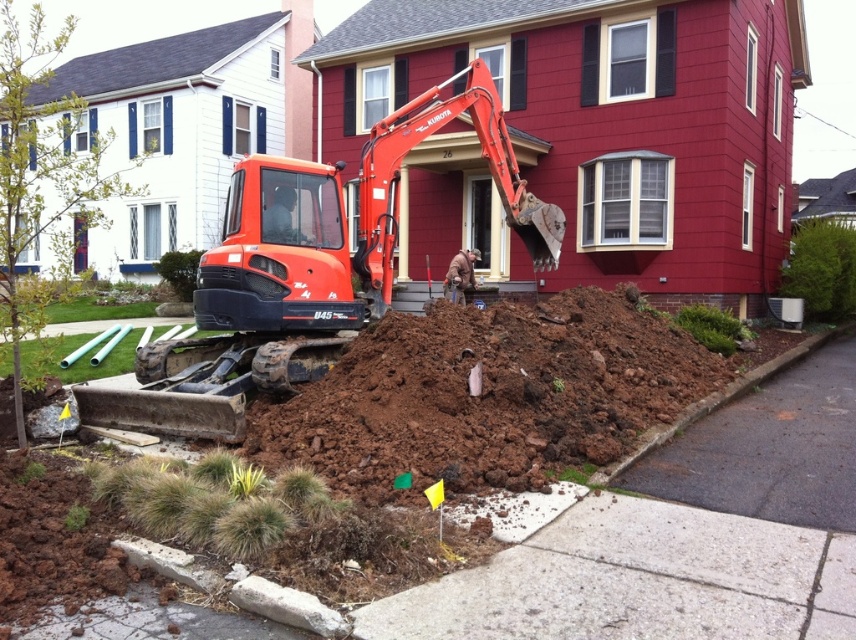
Does gray concrete sidewalk at lower center appear over dark gray asphalt at lower right?

Actually, gray concrete sidewalk at lower center is below dark gray asphalt at lower right.

Image resolution: width=856 pixels, height=640 pixels. I want to click on gray concrete sidewalk at lower center, so click(x=637, y=580).

Is brown dirt at center in front of gray concrete sidewalk at lower center?

No, it is not.

Does brown dirt at center appear on the left side of gray concrete sidewalk at lower center?

Indeed, brown dirt at center is positioned on the left side of gray concrete sidewalk at lower center.

Measure the distance between point (635, 358) and camera.

Point (635, 358) is 8.85 meters from camera.

Locate an element on the screen. This screenshot has width=856, height=640. brown dirt at center is located at coordinates (486, 394).

Looking at this image, is brown dirt at center wider than orange metallic excavator at center?

Correct, the width of brown dirt at center exceeds that of orange metallic excavator at center.

Is brown dirt at center taller than orange metallic excavator at center?

Yes.

Does point (714, 378) come closer to viewer compared to point (483, 129)?

Yes, point (714, 378) is closer to viewer.

The height and width of the screenshot is (640, 856). Find the location of `brown dirt at center`. brown dirt at center is located at coordinates (486, 394).